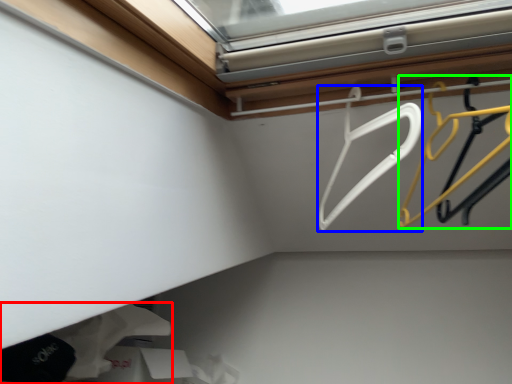
Question: Considering the real-world distances, which object is closest to clothing (highlighted by a red box)? hanger (highlighted by a blue box) or hanger (highlighted by a green box).

Choices:
 (A) hanger
 (B) hanger

Answer: (A)